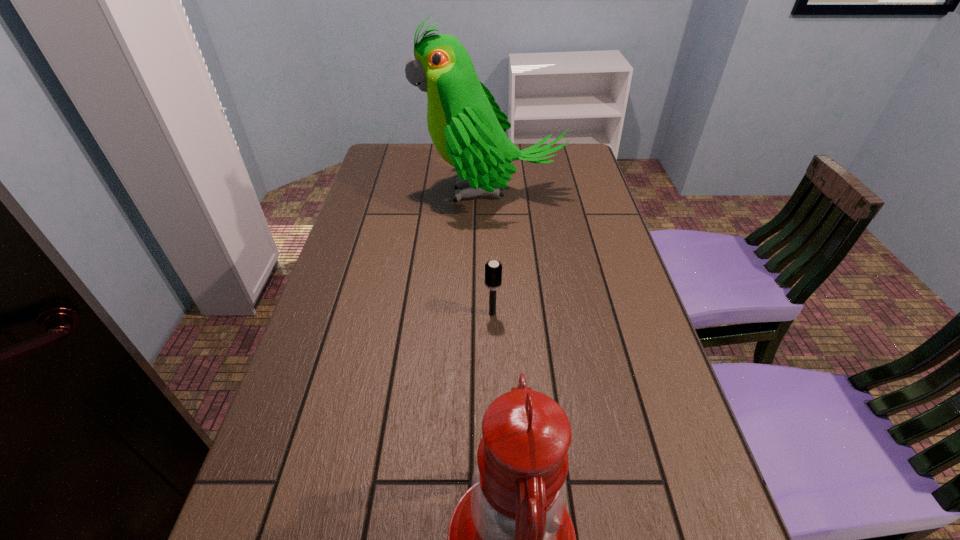
In the image, there is a desktop. What are the coordinates of `vacant space at the far edge` in the screenshot? It's located at (444, 165).

The image size is (960, 540). What are the coordinates of `vacant space at the left edge of the desktop` in the screenshot? It's located at (324, 310).

Where is `vacant area at the right edge`? Image resolution: width=960 pixels, height=540 pixels. vacant area at the right edge is located at coordinates (619, 261).

What are the coordinates of `free space at the far left corner of the desktop` in the screenshot? It's located at (414, 151).

Find the location of a particular element. The height and width of the screenshot is (540, 960). vacant area between the shortest object and the farthest object is located at coordinates (492, 253).

You are a GUI agent. You are given a task and a screenshot of the screen. Output one action in this format:
    pyautogui.click(x=<x>, y=<y>)
    Task: Click on the vacant area between the tallest object and the shortest object
    The height and width of the screenshot is (540, 960).
    Given the screenshot: What is the action you would take?
    pos(492,253)

Identify which object is located as the nearest to the shortest object. Please provide its 2D coordinates. Your answer should be formatted as a tuple, i.e. [(x, y)], where the tuple contains the x and y coordinates of a point satisfying the conditions above.

[(467, 127)]

You are a GUI agent. You are given a task and a screenshot of the screen. Output one action in this format:
    pyautogui.click(x=<x>, y=<y>)
    Task: Click on the object that is the second nearest to the farthest object
    The width and height of the screenshot is (960, 540).
    Given the screenshot: What is the action you would take?
    pyautogui.click(x=510, y=539)

This screenshot has width=960, height=540. What are the coordinates of `free space in the image that satisfies the following two spatial constraints: 1. on the beak of the farthest object; 2. on the front side of the hairbrush` in the screenshot? It's located at (493, 314).